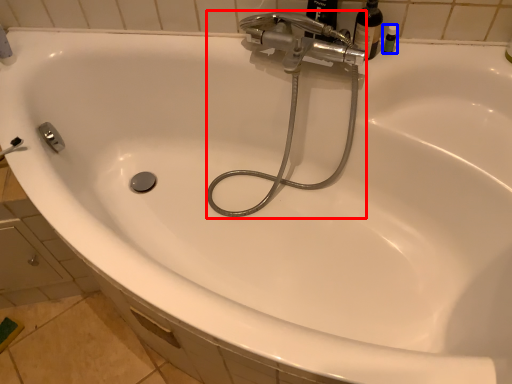
Question: Which object appears farthest to the camera in this image, plumbing fixture (highlighted by a red box) or toiletry (highlighted by a blue box)?

Choices:
 (A) plumbing fixture
 (B) toiletry

Answer: (B)